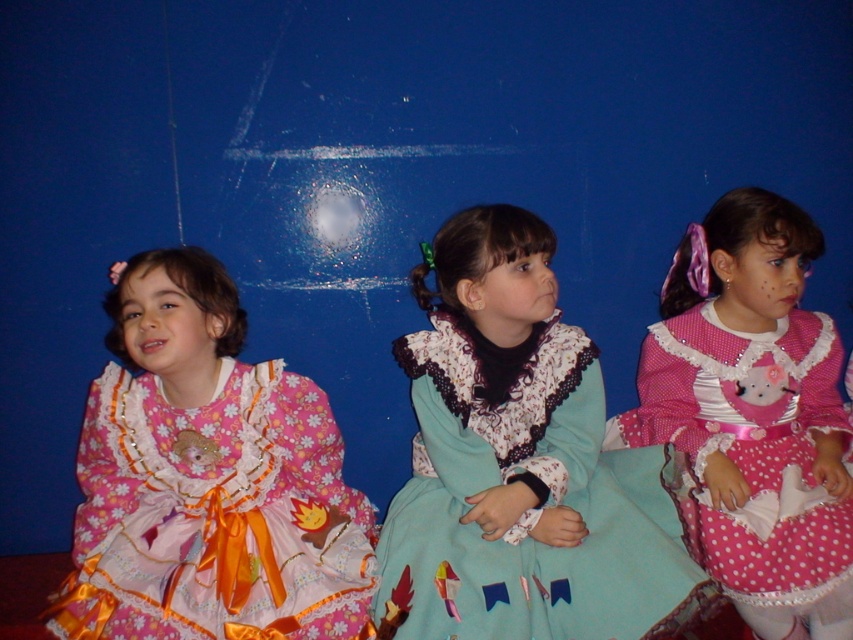
Looking at this image, is pink satin dress at left below pink polka dot dress at center?

Yes.

Does pink satin dress at left have a larger size compared to pink polka dot dress at center?

Actually, pink satin dress at left might be smaller than pink polka dot dress at center.

Does point (283, 524) lie behind point (824, 342)?

No, (283, 524) is closer to viewer.

The height and width of the screenshot is (640, 853). I want to click on pink satin dress at left, so click(215, 515).

Which is below, teal satin dress at center or pink polka dot dress at center?

teal satin dress at center is below.

Is teal satin dress at center to the left of pink polka dot dress at center from the viewer's perspective?

Correct, you'll find teal satin dress at center to the left of pink polka dot dress at center.

I want to click on teal satin dress at center, so click(529, 508).

Find the location of a particular element. teal satin dress at center is located at coordinates (529, 508).

Is pink satin dress at left smaller than teal satin dress at center?

Yes, pink satin dress at left is smaller than teal satin dress at center.

Can you confirm if pink satin dress at left is bigger than teal satin dress at center?

No, pink satin dress at left is not bigger than teal satin dress at center.

Does point (253, 632) come closer to viewer compared to point (512, 602)?

That is True.

Image resolution: width=853 pixels, height=640 pixels. What are the coordinates of `pink satin dress at left` in the screenshot? It's located at (215, 515).